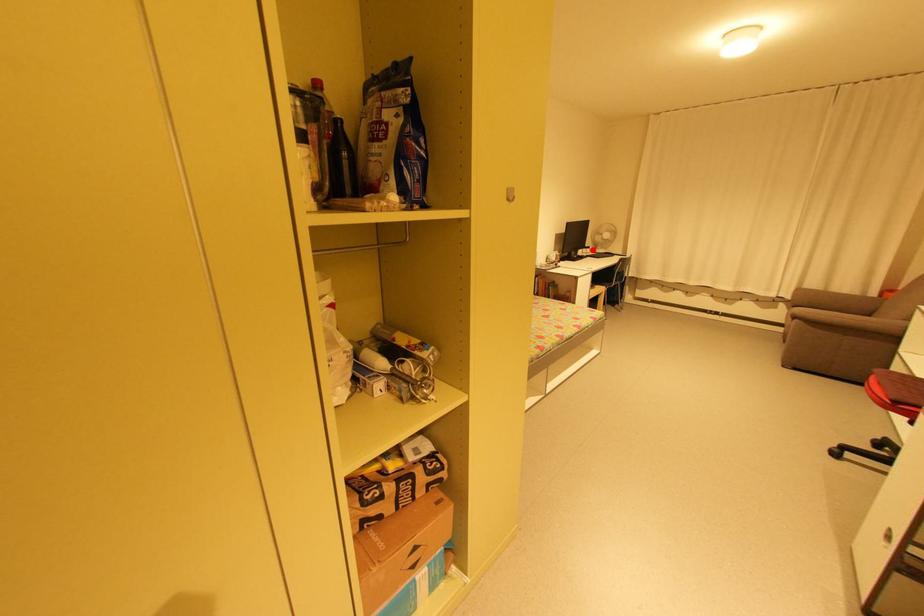
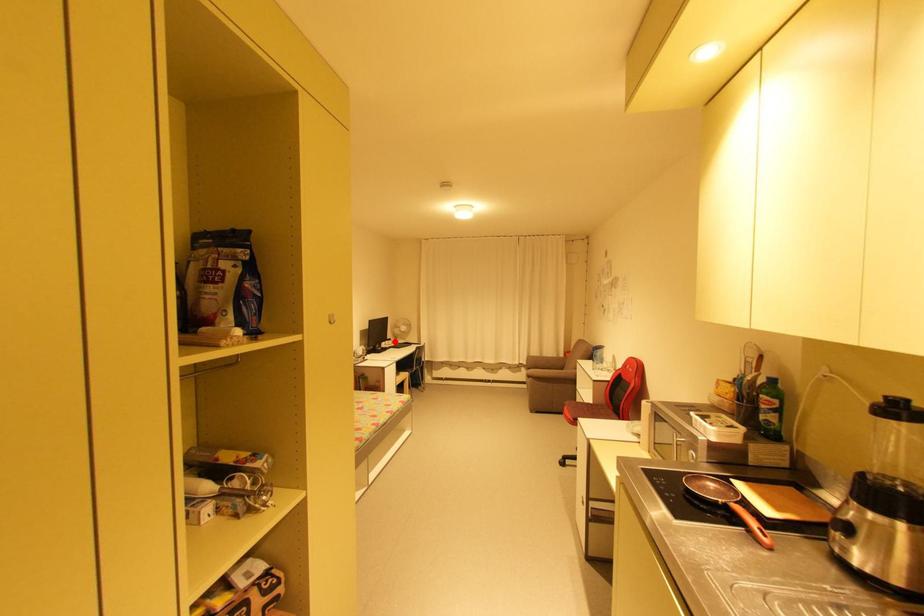
I am providing you with two images of the same scene from different viewpoints. A red point is marked on the first image and another point is marked on the second image. Is the marked point in image1 the same physical position as the marked point in image2?

Yes